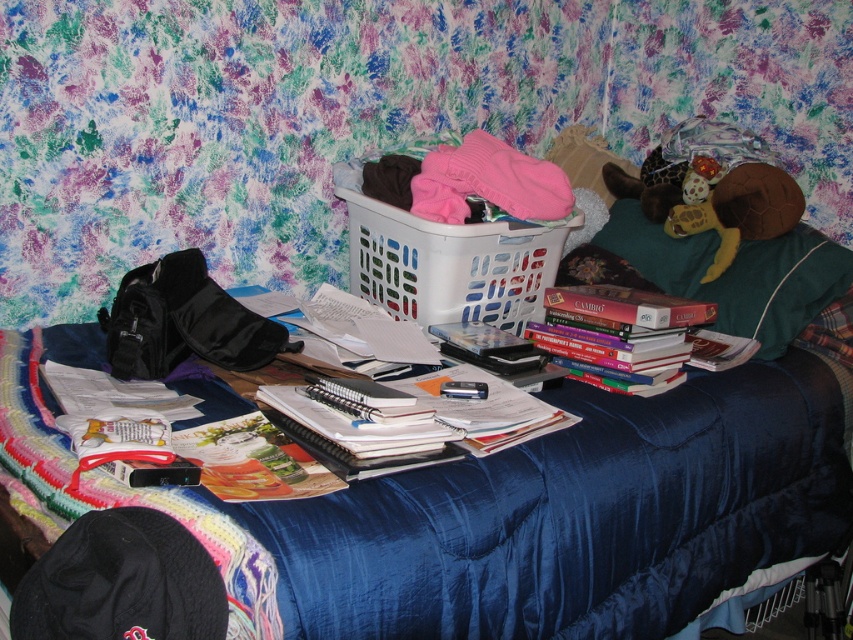
Based on the photo, is white plastic laundry basket at center below green fabric pillow at upper right?

Incorrect, white plastic laundry basket at center is not positioned below green fabric pillow at upper right.

Between white plastic laundry basket at center and green fabric pillow at upper right, which one has more height?

With more height is green fabric pillow at upper right.

Is point (442, 305) closer to viewer compared to point (776, 300)?

Yes.

Locate an element on the screen. white plastic laundry basket at center is located at coordinates (447, 260).

Does white plastic laundry basket at center have a greater width compared to hardcover books at center?

Indeed, white plastic laundry basket at center has a greater width compared to hardcover books at center.

Does white plastic laundry basket at center lie in front of hardcover books at center?

No, it is behind hardcover books at center.

Is point (550, 273) positioned after point (595, 301)?

Yes, point (550, 273) is behind point (595, 301).

Find the location of a particular element. The width and height of the screenshot is (853, 640). white plastic laundry basket at center is located at coordinates (447, 260).

Is green fabric pillow at upper right positioned before hardcover books at center?

That is False.

Is green fabric pillow at upper right above hardcover books at center?

Correct, green fabric pillow at upper right is located above hardcover books at center.

You are a GUI agent. You are given a task and a screenshot of the screen. Output one action in this format:
    pyautogui.click(x=<x>, y=<y>)
    Task: Click on the green fabric pillow at upper right
    The image size is (853, 640).
    Given the screenshot: What is the action you would take?
    pyautogui.click(x=737, y=275)